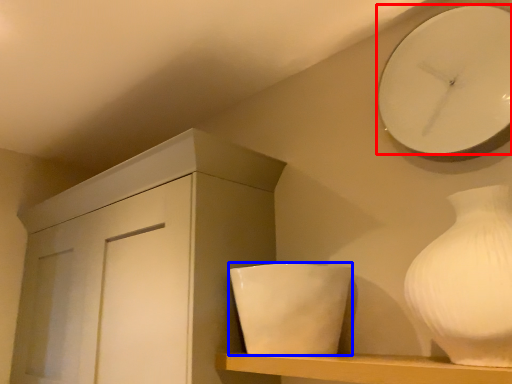
Question: Which object appears closest to the camera in this image, wall clock (highlighted by a red box) or ceramic (highlighted by a blue box)?

Choices:
 (A) wall clock
 (B) ceramic

Answer: (A)